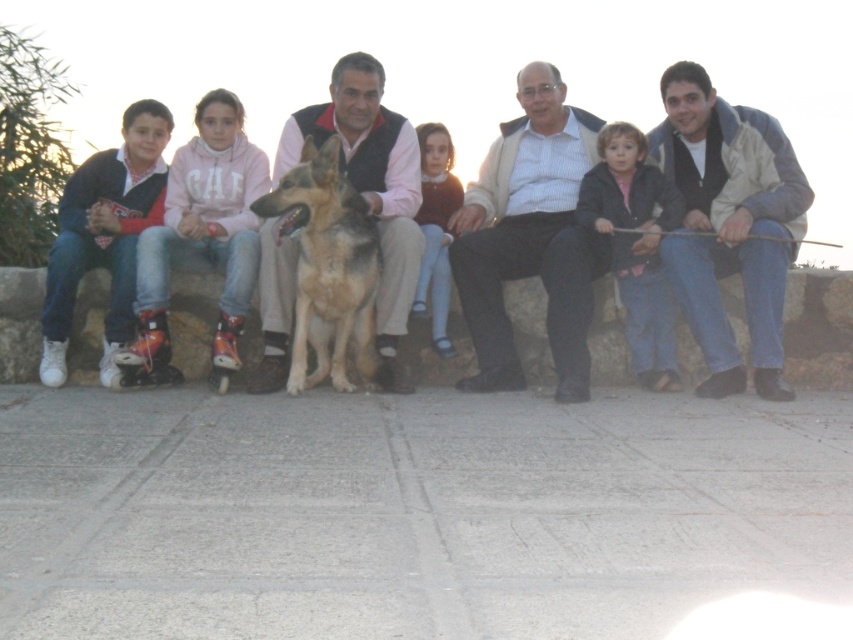
You are a photographer trying to adjust the lighting for a group photo. You notice the light brown fabric dress at center and the matte black jacket at center. Which object is closer to the camera?

The matte black jacket at center is closer to the camera because the light brown fabric dress at center is behind it.

You are a photographer trying to capture a clear shot of both the golden fur dog at center and the light brown fabric dress at center. Based on their positions, which object is closer to the camera?

The golden fur dog at center is positioned under the light brown fabric dress at center, meaning the dress is closer to the camera than the dog.